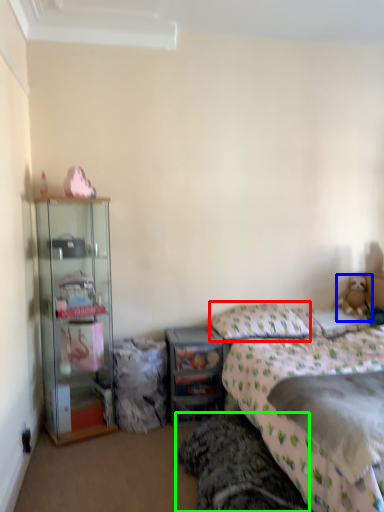
Question: Which object is positioned closest to pillow (highlighted by a red box)? Select from teddy bear (highlighted by a blue box) and bed frame (highlighted by a green box).

Choices:
 (A) teddy bear
 (B) bed frame

Answer: (A)